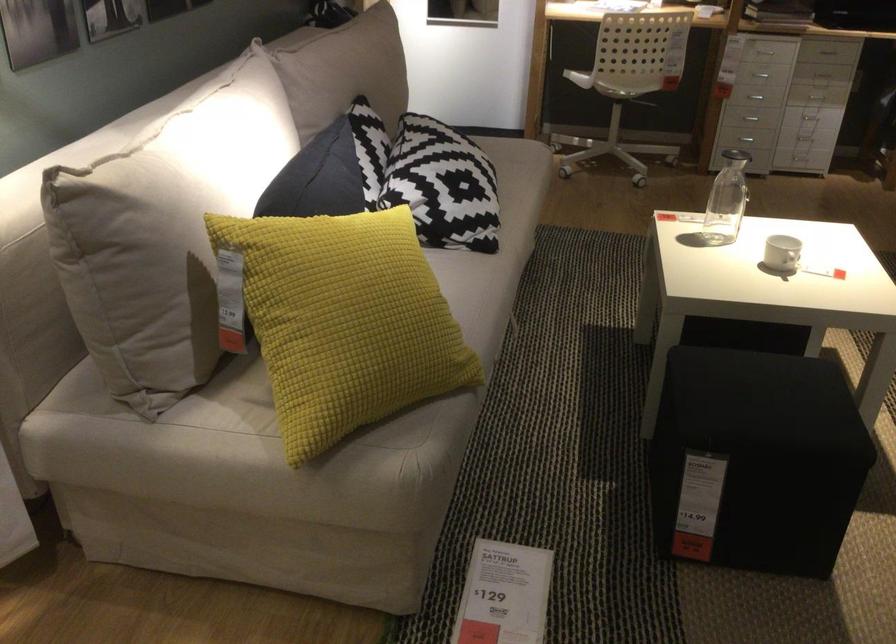
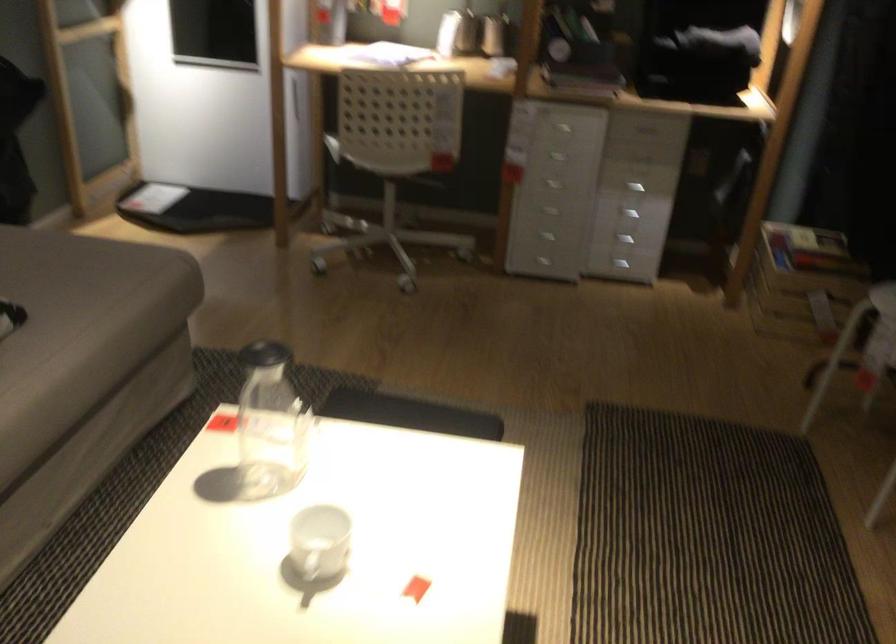
Locate, in the second image, the point that corresponds to (x=692, y=220) in the first image.

(270, 424)